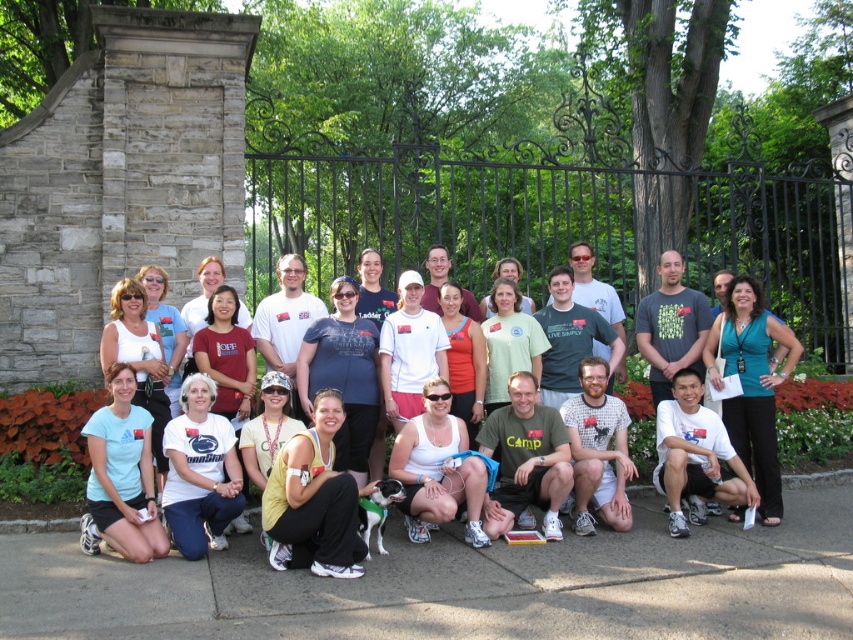
Is the position of matte blue t-shirt at center less distant than that of white cotton shirt at center?

No, matte blue t-shirt at center is further to the viewer.

Does matte blue t-shirt at center appear over white cotton shirt at center?

Indeed, matte blue t-shirt at center is positioned over white cotton shirt at center.

Between point (312, 385) and point (300, 371), which one is positioned in front?

Positioned in front is point (300, 371).

Image resolution: width=853 pixels, height=640 pixels. I want to click on matte blue t-shirt at center, so pyautogui.click(x=343, y=374).

Does point (109, 534) lie in front of point (505, 262)?

Yes, it is in front of point (505, 262).

Which is below, light blue t-shirt at lower left or light green t-shirt at center?

Positioned lower is light blue t-shirt at lower left.

Describe the element at coordinates (120, 476) in the screenshot. The height and width of the screenshot is (640, 853). I see `light blue t-shirt at lower left` at that location.

Where is `light blue t-shirt at lower left`? The height and width of the screenshot is (640, 853). light blue t-shirt at lower left is located at coordinates (120, 476).

Between light blue t-shirt at lower left and matte blue t-shirt at center, which one is positioned lower?

light blue t-shirt at lower left is lower down.

Between light blue t-shirt at lower left and matte blue t-shirt at center, which one is positioned higher?

matte blue t-shirt at center

In order to click on light blue t-shirt at lower left in this screenshot , I will do `click(120, 476)`.